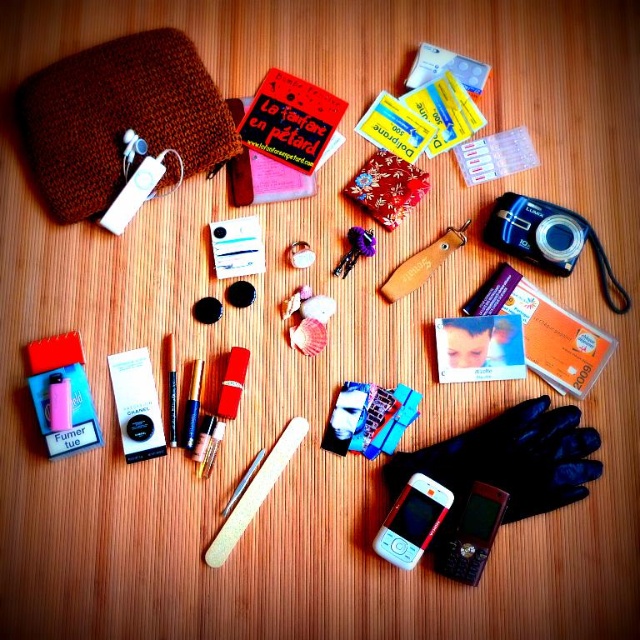
Is point (132, 352) farther from camera compared to point (285, 433)?

No, it is in front of (285, 433).

Does matte black cigarette case at center-left appear over wooden nail file at center?

Yes, matte black cigarette case at center-left is above wooden nail file at center.

Does point (152, 445) come closer to viewer compared to point (220, 564)?

No, (152, 445) is further to viewer.

You are a GUI agent. You are given a task and a screenshot of the screen. Output one action in this format:
    pyautogui.click(x=<x>, y=<y>)
    Task: Click on the matte black cigarette case at center-left
    
    Given the screenshot: What is the action you would take?
    pyautogui.click(x=136, y=404)

This screenshot has height=640, width=640. What are the coordinates of `brown knitted pouch at upper left` in the screenshot? It's located at (120, 118).

Does brown knitted pouch at upper left have a greater width compared to wooden comb at center?

Yes, brown knitted pouch at upper left is wider than wooden comb at center.

Is point (93, 45) positioned behind point (420, 269)?

Yes, point (93, 45) is behind point (420, 269).

The image size is (640, 640). Find the location of `brown knitted pouch at upper left`. brown knitted pouch at upper left is located at coordinates (120, 118).

Does wooden comb at center have a lesser width compared to purple fabric keychain at center?

Incorrect, wooden comb at center's width is not less than purple fabric keychain at center's.

Based on the photo, does wooden comb at center appear on the left side of purple fabric keychain at center?

In fact, wooden comb at center is to the right of purple fabric keychain at center.

The width and height of the screenshot is (640, 640). I want to click on wooden comb at center, so click(422, 262).